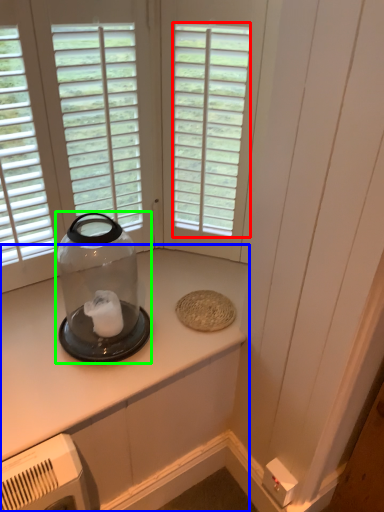
Question: Considering the real-world distances, which object is closest to window (highlighted by a red box)? countertop (highlighted by a blue box) or glass bottle (highlighted by a green box).

Choices:
 (A) countertop
 (B) glass bottle

Answer: (B)